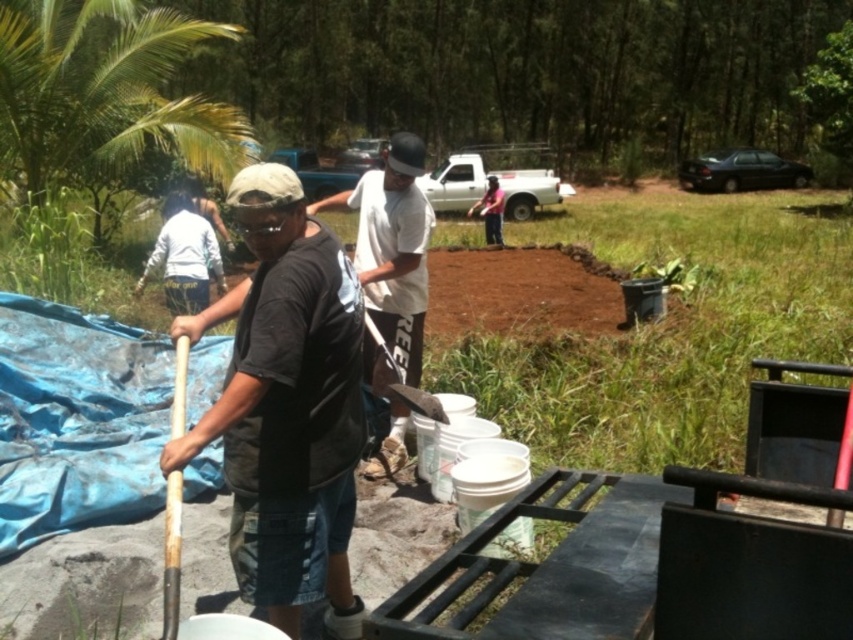
Question: Which point is farther from the camera taking this photo?

Choices:
 (A) (367, 332)
 (B) (308, 602)
 (C) (415, 403)

Answer: (A)

Question: Which point is farther from the camera taking this photo?

Choices:
 (A) (418, 396)
 (B) (202, 420)

Answer: (A)

Question: In this image, where is white cotton shirt at center located relative to wooden handle shovel at center?

Choices:
 (A) right
 (B) left

Answer: (A)

Question: Considering the relative positions of dark gray t-shirt at center and white cotton shirt at center in the image provided, where is dark gray t-shirt at center located with respect to white cotton shirt at center?

Choices:
 (A) right
 (B) left

Answer: (B)

Question: Does white cotton shirt at center have a greater width compared to wooden handle shovel at center?

Choices:
 (A) yes
 (B) no

Answer: (B)

Question: Which is farther from the dark gray t-shirt at center?

Choices:
 (A) wooden handle shovel at center
 (B) white cotton shirt at center

Answer: (B)